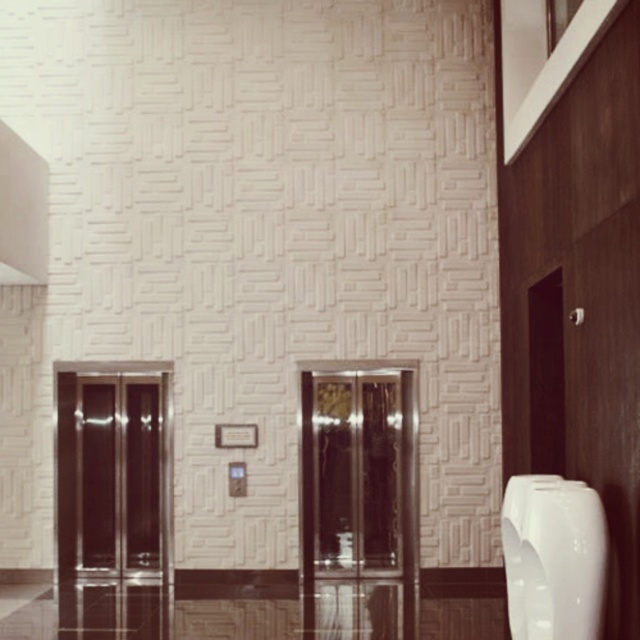
Question: Can you confirm if shiny glass elevator at center is positioned below white glossy urinal at right?

Choices:
 (A) yes
 (B) no

Answer: (B)

Question: Is the position of shiny glass elevator at center more distant than that of white glossy urinal at right?

Choices:
 (A) no
 (B) yes

Answer: (B)

Question: Estimate the real-world distances between objects in this image. Which object is closer to the shiny metallic elevator doors at left?

Choices:
 (A) white glossy urinal at right
 (B) shiny glass elevator at center

Answer: (B)

Question: Which object is the farthest from the white glossy urinal at right?

Choices:
 (A) shiny glass elevator at center
 (B) shiny metallic elevator doors at left

Answer: (B)

Question: Is shiny glass elevator at center to the left of white glossy urinal at right from the viewer's perspective?

Choices:
 (A) yes
 (B) no

Answer: (A)

Question: Which point is farther to the camera?

Choices:
 (A) shiny metallic elevator doors at left
 (B) shiny glass elevator at center
 (C) white glossy urinal at right

Answer: (B)